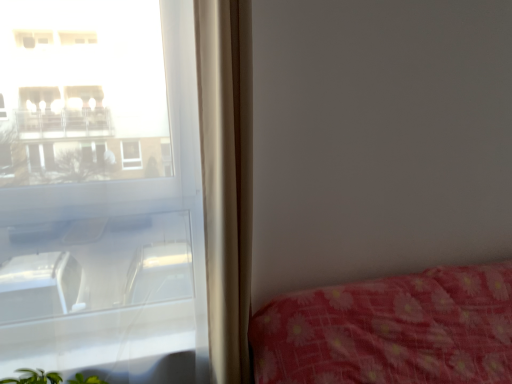
Question: Can we say transparent glass window at left lies outside beige fabric curtain at left?

Choices:
 (A) no
 (B) yes

Answer: (B)

Question: Can you confirm if transparent glass window at left is thinner than beige fabric curtain at left?

Choices:
 (A) no
 (B) yes

Answer: (B)

Question: Is transparent glass window at left positioned in front of beige fabric curtain at left?

Choices:
 (A) yes
 (B) no

Answer: (A)

Question: Considering the relative positions of transparent glass window at left and beige fabric curtain at left in the image provided, is transparent glass window at left behind beige fabric curtain at left?

Choices:
 (A) no
 (B) yes

Answer: (A)

Question: Is transparent glass window at left bigger than beige fabric curtain at left?

Choices:
 (A) no
 (B) yes

Answer: (B)

Question: Considering the relative sizes of transparent glass window at left and beige fabric curtain at left in the image provided, is transparent glass window at left shorter than beige fabric curtain at left?

Choices:
 (A) no
 (B) yes

Answer: (A)

Question: Is beige fabric curtain at left closer to the viewer compared to transparent glass window at left?

Choices:
 (A) yes
 (B) no

Answer: (B)

Question: From the image's perspective, is beige fabric curtain at left over transparent glass window at left?

Choices:
 (A) no
 (B) yes

Answer: (B)

Question: Is transparent glass window at left at the back of beige fabric curtain at left?

Choices:
 (A) no
 (B) yes

Answer: (A)

Question: Does beige fabric curtain at left turn towards transparent glass window at left?

Choices:
 (A) no
 (B) yes

Answer: (A)

Question: Does beige fabric curtain at left have a greater width compared to transparent glass window at left?

Choices:
 (A) no
 (B) yes

Answer: (B)

Question: Can we say beige fabric curtain at left lies outside transparent glass window at left?

Choices:
 (A) no
 (B) yes

Answer: (B)

Question: Is transparent glass window at left bigger or smaller than beige fabric curtain at left?

Choices:
 (A) small
 (B) big

Answer: (B)